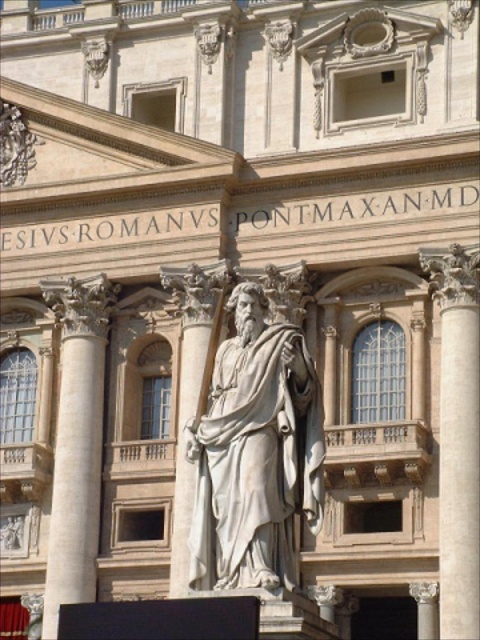
You are standing in front of the grand classical building and want to place a 60 meter long decorative banner between the white marble column at left and the large statue of a man in the foreground. Will the banner fit without overlapping either structure?

The distance between the white marble column at left and the large statue of a man in the foreground is 65.08 meters. Since the banner is 60 meters long, it will fit between them without overlapping either structure as there is enough space.

You are an architect examining the classical building. You notice two columns, the white marble column at left and the white marble column at center. Which one is closer to you?

The white marble column at left is closer to you because it is further to the viewer than the white marble column at center.

You are an architect examining the building facade. You notice a point at coordinates (76,442). Based on the scene, can you determine which architectural element this point belongs to?

The point at coordinates (76,442) is on the white marble column at left.